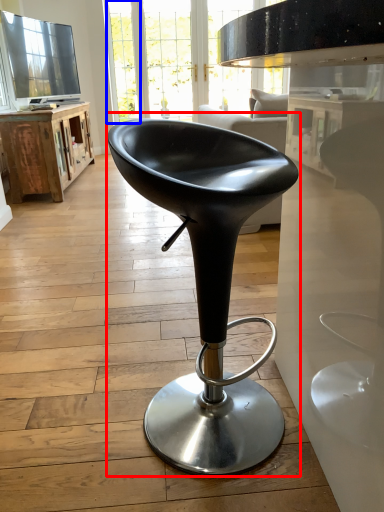
Question: Which object is further to the camera taking this photo, chair (highlighted by a red box) or glass door (highlighted by a blue box)?

Choices:
 (A) chair
 (B) glass door

Answer: (B)